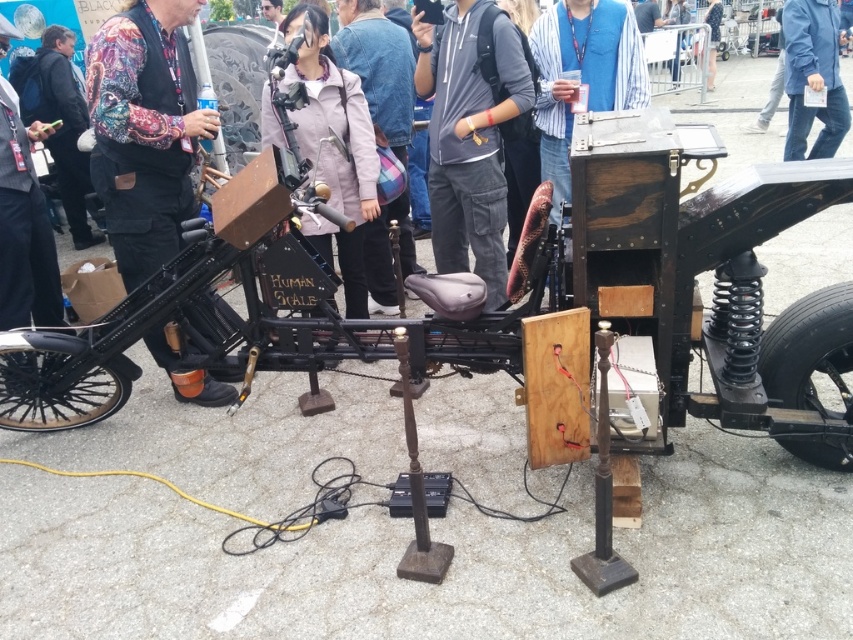
You are attending an outdoor exhibition and notice two people in the crowd near the vintage vehicle. One is wearing a patterned fabric shirt at center and the other a light purple fabric jacket at center. Which clothing item is smaller in size?

The patterned fabric shirt at center has a smaller size compared to the light purple fabric jacket at center.

You are a photographer at the event and need to capture both the patterned fabric shirt at center and the light purple fabric jacket at center in a single photo. Since the camera can only focus on objects of similar height, will you need to adjust the camera angle to ensure both are in focus?

The patterned fabric shirt at center is not as tall as light purple fabric jacket at center, so the height difference might require adjusting the camera angle to ensure both are in focus.

You are standing in front of the vintage vehicle and want to know which of the two points, point (160,64) or point (795,116), is closer to you. Can you determine this based on the description?

Point (160,64) is closer to the camera than point (795,116), so it is closer to you.